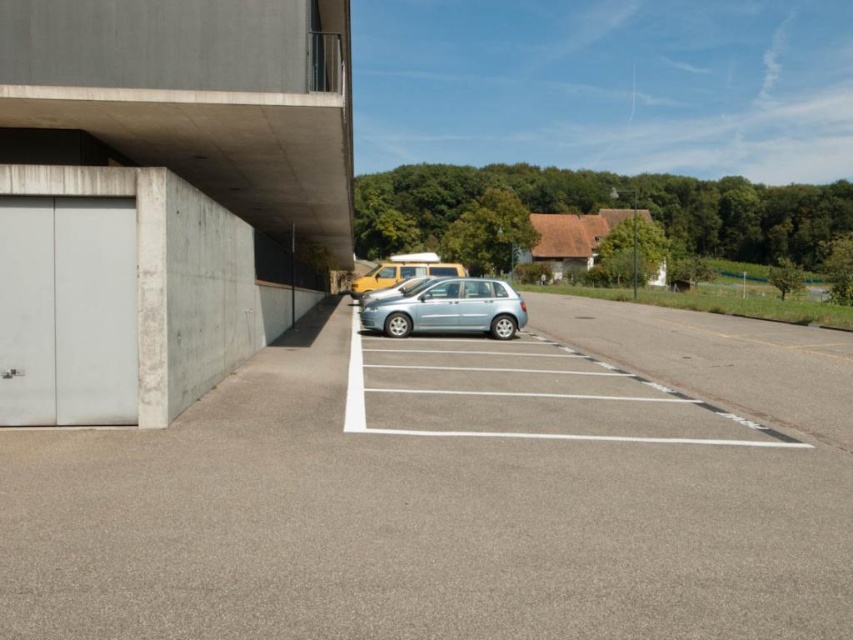
You are driving a car and need to park in the gray asphalt parking lot at center. The satin blue hatchback at center is already parked there. Can you estimate if the parking lot space is wide enough for your car?

The gray asphalt parking lot at center might be wider than the satin blue hatchback at center, so there could be enough space for your car.